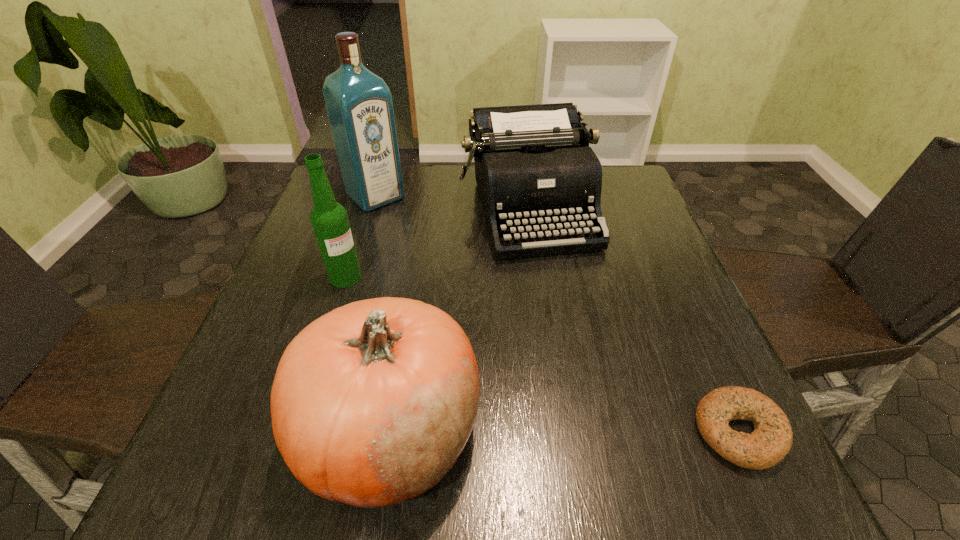
Identify the location of bagel present at the near edge. The width and height of the screenshot is (960, 540). (771, 440).

This screenshot has height=540, width=960. I want to click on pumpkin at the left edge, so click(372, 403).

Identify the location of beer bottle positioned at the left edge. The image size is (960, 540). (329, 219).

Locate an element on the screen. This screenshot has height=540, width=960. liquor located in the left edge section of the desktop is located at coordinates pos(359,104).

The width and height of the screenshot is (960, 540). Find the location of `bagel that is at the right edge`. bagel that is at the right edge is located at coordinates (771, 440).

You are a GUI agent. You are given a task and a screenshot of the screen. Output one action in this format:
    pyautogui.click(x=<x>, y=<y>)
    Task: Click on the typewriter that is at the right edge
    The width and height of the screenshot is (960, 540).
    Given the screenshot: What is the action you would take?
    pyautogui.click(x=534, y=168)

In order to click on object located in the far left corner section of the desktop in this screenshot , I will do `click(359, 104)`.

Identify the location of object present at the near left corner. This screenshot has height=540, width=960. (372, 403).

At what (x,y) coordinates should I click in order to perform the action: click on object that is positioned at the far right corner. Please return your answer as a coordinate pair (x, y). Looking at the image, I should click on (534, 168).

The width and height of the screenshot is (960, 540). Find the location of `object that is at the near right corner`. object that is at the near right corner is located at coordinates (771, 440).